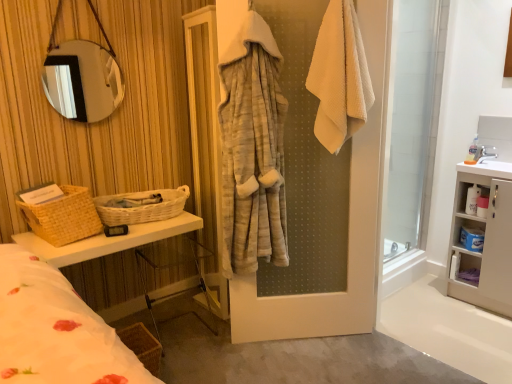
Question: Is the position of white waffle-textured towel at upper right less distant than that of woven beige basket at left, placed as the second basket when sorted from bottom to top?

Choices:
 (A) yes
 (B) no

Answer: (A)

Question: Does white waffle-textured towel at upper right have a lesser height compared to woven beige basket at left, which appears as the third basket when viewed from the right?

Choices:
 (A) yes
 (B) no

Answer: (B)

Question: Is white waffle-textured towel at upper right completely or partially outside of woven beige basket at left, placed as the second basket when sorted from bottom to top?

Choices:
 (A) yes
 (B) no

Answer: (A)

Question: Is white waffle-textured towel at upper right not near woven beige basket at left, the 1th basket positioned from the left?

Choices:
 (A) no
 (B) yes

Answer: (B)

Question: Is white waffle-textured towel at upper right to the right of woven beige basket at left, placed as the second basket when sorted from bottom to top, from the viewer's perspective?

Choices:
 (A) yes
 (B) no

Answer: (A)

Question: Considering the relative sizes of white waffle-textured towel at upper right and woven beige basket at left, which appears as the second basket when viewed from the top, in the image provided, is white waffle-textured towel at upper right bigger than woven beige basket at left, which appears as the second basket when viewed from the top,?

Choices:
 (A) no
 (B) yes

Answer: (B)

Question: From a real-world perspective, is white glossy sink at upper right physically above blue plastic container at right, the second cabinet from the top?

Choices:
 (A) no
 (B) yes

Answer: (B)

Question: From the image's perspective, is white glossy sink at upper right on blue plastic container at right, arranged as the 1th cabinet when ordered from the bottom?

Choices:
 (A) no
 (B) yes

Answer: (B)

Question: Considering the relative sizes of white glossy sink at upper right and blue plastic container at right, the second cabinet from the top, in the image provided, is white glossy sink at upper right taller than blue plastic container at right, the second cabinet from the top,?

Choices:
 (A) no
 (B) yes

Answer: (A)

Question: Is white glossy sink at upper right bigger than blue plastic container at right, the second cabinet from the top?

Choices:
 (A) yes
 (B) no

Answer: (A)

Question: Is blue plastic container at right, the second cabinet from the top, completely or partially inside white glossy sink at upper right?

Choices:
 (A) no
 (B) yes

Answer: (A)

Question: From the image's perspective, is white glossy sink at upper right below blue plastic container at right, arranged as the 1th cabinet when ordered from the bottom?

Choices:
 (A) yes
 (B) no

Answer: (B)

Question: Is white plastic cabinet at right, which is the 2th cabinet from bottom to top, closer to the viewer compared to white matte cabinet at right?

Choices:
 (A) no
 (B) yes

Answer: (A)